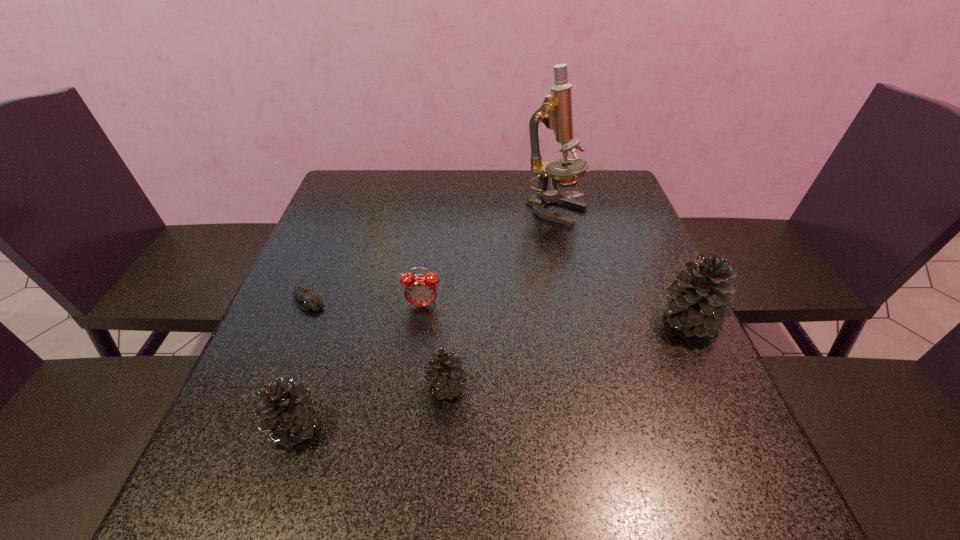
Please point a location where one more pinecone can be added evenly. Please provide its 2D coordinates. Your answer should be formatted as a tuple, i.e. [(x, y)], where the tuple contains the x and y coordinates of a point satisfying the conditions above.

[(577, 352)]